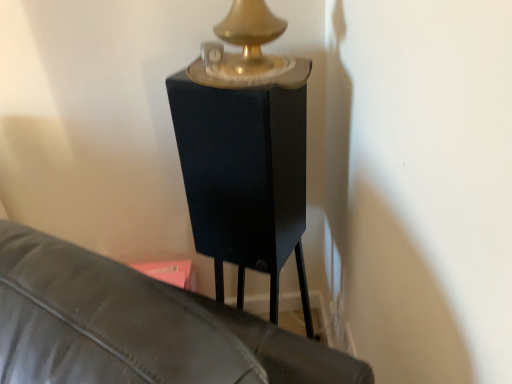
What is the approximate width of black matte table at center?

The width of black matte table at center is 11.78 inches.

This screenshot has height=384, width=512. Identify the location of black matte table at center. (245, 172).

The height and width of the screenshot is (384, 512). What do you see at coordinates (245, 172) in the screenshot?
I see `black matte table at center` at bounding box center [245, 172].

This screenshot has height=384, width=512. In order to click on black matte table at center in this screenshot , I will do `click(245, 172)`.